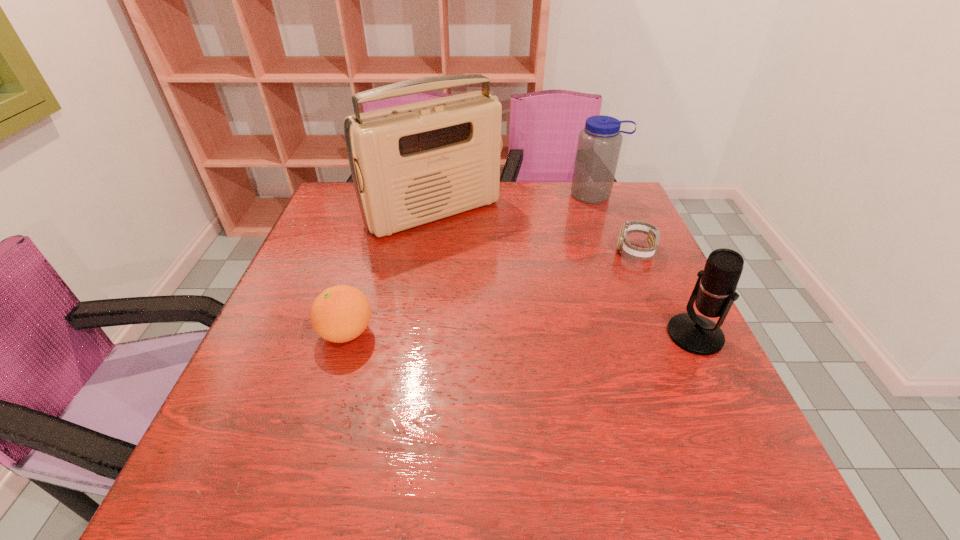
The width and height of the screenshot is (960, 540). Find the location of `empty space that is in between the microphone and the shortest object`. empty space that is in between the microphone and the shortest object is located at coordinates (665, 293).

At what (x,y) coordinates should I click in order to perform the action: click on the third closest object to the tallest object. Please return your answer as a coordinate pair (x, y). Looking at the image, I should click on (624, 247).

Select which object is the closest to the watch. Please provide its 2D coordinates. Your answer should be formatted as a tuple, i.e. [(x, y)], where the tuple contains the x and y coordinates of a point satisfying the conditions above.

[(599, 143)]

Image resolution: width=960 pixels, height=540 pixels. In order to click on free spot that satisfies the following two spatial constraints: 1. on the back side of the water bottle; 2. on the left side of the second shortest object in this screenshot , I will do click(388, 195).

Find the location of a particular element. vacant area that satisfies the following two spatial constraints: 1. on the front side of the watch; 2. on the left side of the radio receiver is located at coordinates 428,251.

At what (x,y) coordinates should I click in order to perform the action: click on free space that satisfies the following two spatial constraints: 1. on the back side of the water bottle; 2. on the right side of the fourth tallest object. Please return your answer as a coordinate pair (x, y). Looking at the image, I should click on (388, 195).